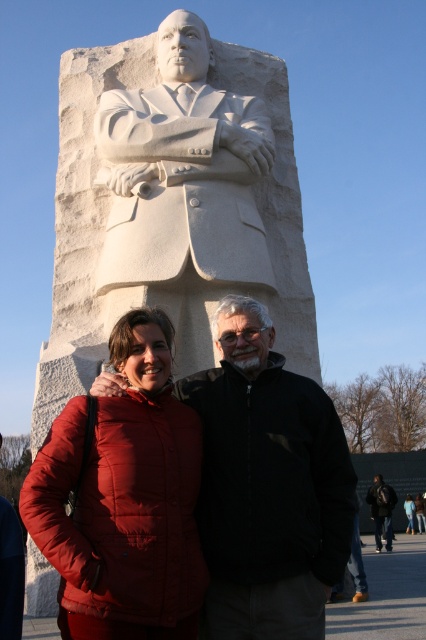
You are a photographer trying to capture a photo of the white marble statue at center and the red puffer jacket at center. Since the statue is above the jacket, where should you position your camera to ensure both subjects are in focus?

Since the white marble statue at center is located above the red puffer jacket at center, you should position your camera at a slightly elevated angle to capture both subjects in focus, ensuring the statue and the jacket are clearly visible within the frame.

You are a photographer trying to capture a photo of the statue. You notice the matte red jacket at lower left and the dark blue jeans at lower right. Which object is closer to the statue?

The matte red jacket at lower left is positioned over dark blue jeans at lower right, meaning it is closer to the statue.